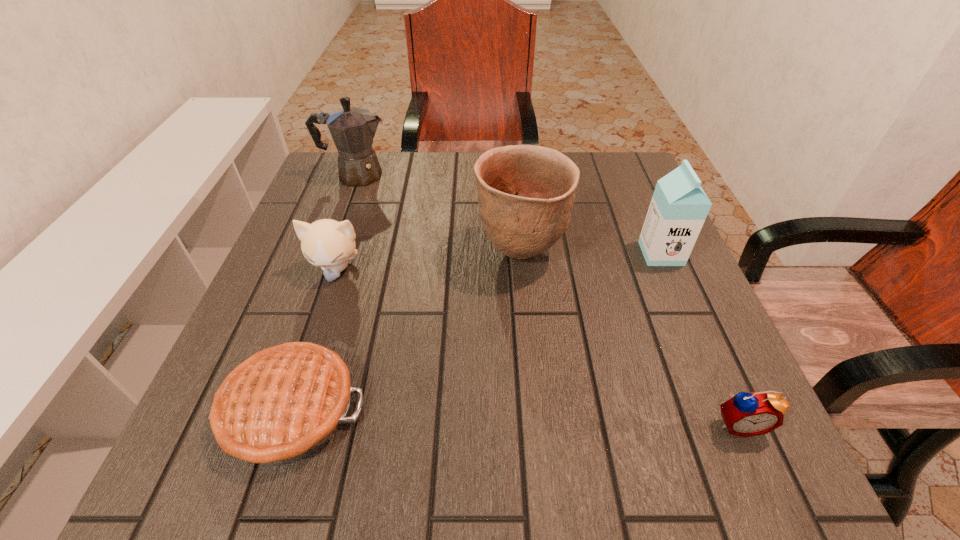
At what (x,y) coordinates should I click in order to perform the action: click on vacant space that is in between the alarm clock and the farthest object. Please return your answer as a coordinate pair (x, y). Looking at the image, I should click on (547, 300).

The width and height of the screenshot is (960, 540). What are the coordinates of `free space between the fourth object from left to right and the milk carton` in the screenshot? It's located at (590, 253).

This screenshot has height=540, width=960. What are the coordinates of `free space between the kitten and the pie` in the screenshot? It's located at (314, 340).

Locate an element on the screen. The width and height of the screenshot is (960, 540). empty space between the fifth tallest object and the third shortest object is located at coordinates click(538, 347).

I want to click on free space between the fifth tallest object and the coffeepot, so click(x=547, y=300).

This screenshot has width=960, height=540. Identify the location of free space between the shortest object and the kitten. (314, 340).

The width and height of the screenshot is (960, 540). What are the coordinates of `the closest object to the alarm clock` in the screenshot? It's located at (526, 193).

Point out which object is positioned as the fifth nearest to the third object from right to left. Please provide its 2D coordinates. Your answer should be formatted as a tuple, i.e. [(x, y)], where the tuple contains the x and y coordinates of a point satisfying the conditions above.

[(745, 414)]

This screenshot has height=540, width=960. In order to click on free space that satisfies the following two spatial constraints: 1. on the back side of the fourth object from left to right; 2. on the left side of the pie in this screenshot , I will do `click(343, 253)`.

Where is `vacant space that satisfies the following two spatial constraints: 1. on the back side of the shortest object; 2. on the pouring side of the farthest object`? This screenshot has height=540, width=960. vacant space that satisfies the following two spatial constraints: 1. on the back side of the shortest object; 2. on the pouring side of the farthest object is located at coordinates (368, 176).